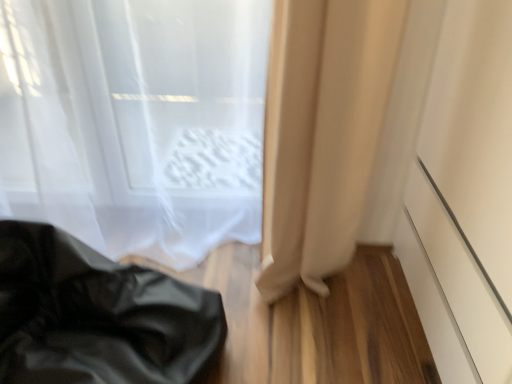
Question: Is black leather bag at lower left bigger or smaller than translucent fabric curtain at upper left, which is counted as the 2th curtain, starting from the right?

Choices:
 (A) small
 (B) big

Answer: (B)

Question: From a real-world perspective, relative to translucent fabric curtain at upper left, the 1th curtain positioned from the left, is black leather bag at lower left vertically above or below?

Choices:
 (A) above
 (B) below

Answer: (B)

Question: Considering the real-world distances, which object is closest to the white matte screen door at right?

Choices:
 (A) black leather bag at lower left
 (B) beige fabric curtain at lower right, which is counted as the second curtain, starting from the left
 (C) translucent fabric curtain at upper left, the 1th curtain positioned from the left

Answer: (B)

Question: Which object is the closest to the translucent fabric curtain at upper left, the 1th curtain positioned from the left?

Choices:
 (A) beige fabric curtain at lower right, which is counted as the second curtain, starting from the left
 (B) white matte screen door at right
 (C) black leather bag at lower left

Answer: (A)